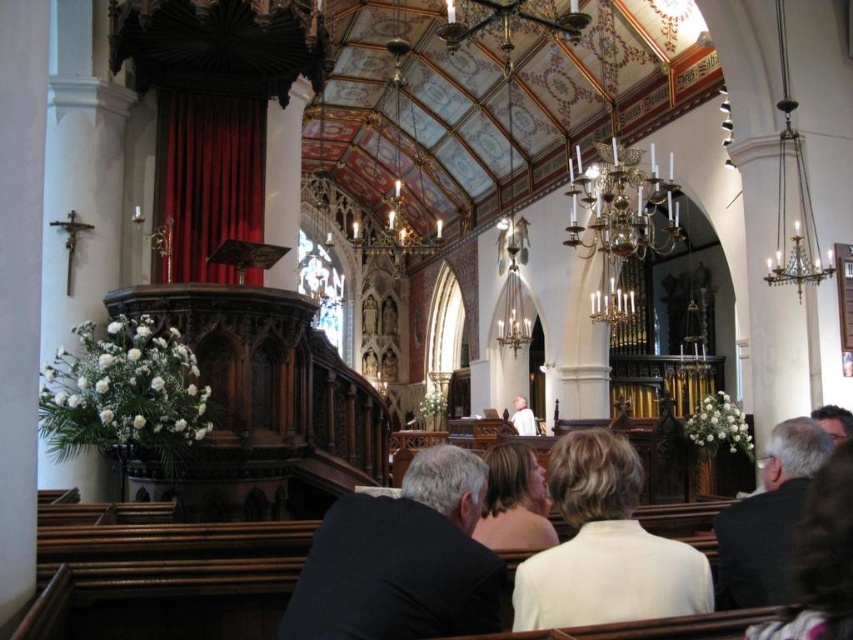
Question: Estimate the real-world distances between objects in this image. Which object is closer to the white fabric at center?

Choices:
 (A) white matte jacket at lower center
 (B) black fabric at center

Answer: (A)

Question: Considering the relative positions of black fabric at center and white matte jacket at lower center in the image provided, where is black fabric at center located with respect to white matte jacket at lower center?

Choices:
 (A) left
 (B) right

Answer: (A)

Question: Does white matte jacket at lower center come behind white fabric at center?

Choices:
 (A) yes
 (B) no

Answer: (B)

Question: Is white matte jacket at lower center wider than white fabric at center?

Choices:
 (A) no
 (B) yes

Answer: (B)

Question: Which of the following is the closest to the observer?

Choices:
 (A) (523, 419)
 (B) (440, 470)

Answer: (B)

Question: Among these objects, which one is nearest to the camera?

Choices:
 (A) white fabric at center
 (B) black fabric at center
 (C) white matte jacket at lower center

Answer: (B)